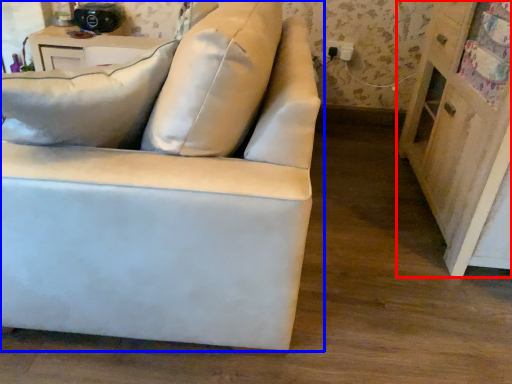
Question: Which point is closer to the camera, dresser (highlighted by a red box) or studio couch (highlighted by a blue box)?

Choices:
 (A) dresser
 (B) studio couch

Answer: (B)